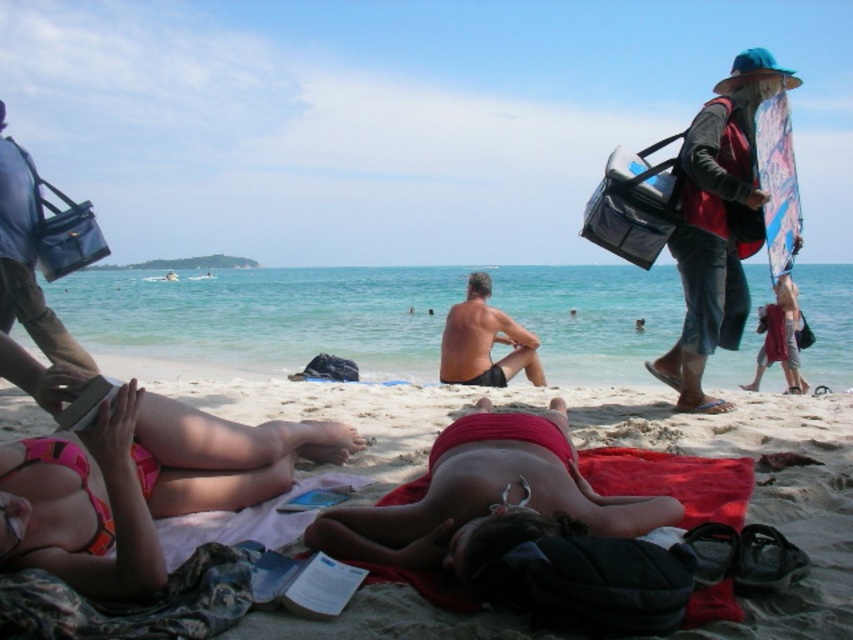
Question: Which is nearer to the matte red towel at center?

Choices:
 (A) red fabric bag at right
 (B) red fabric towel at center
 (C) matte red bikini at center

Answer: (A)

Question: Does red fabric bag at right appear over smooth skin man at center?

Choices:
 (A) yes
 (B) no

Answer: (A)

Question: Which is farther from the pink bikini at lower left?

Choices:
 (A) smooth skin man at center
 (B) red fabric towel at center
 (C) red fabric bag at right
 (D) matte red towel at center

Answer: (A)

Question: Does red fabric bag at right appear on the right side of red fabric towel at center?

Choices:
 (A) no
 (B) yes

Answer: (B)

Question: Is pink bikini at lower left further to camera compared to red fabric bag at right?

Choices:
 (A) yes
 (B) no

Answer: (B)

Question: Which of these objects is positioned closest to the red fabric towel at center?

Choices:
 (A) pink bikini at lower left
 (B) smooth skin man at center
 (C) matte red bikini at center
 (D) red fabric bag at right

Answer: (C)